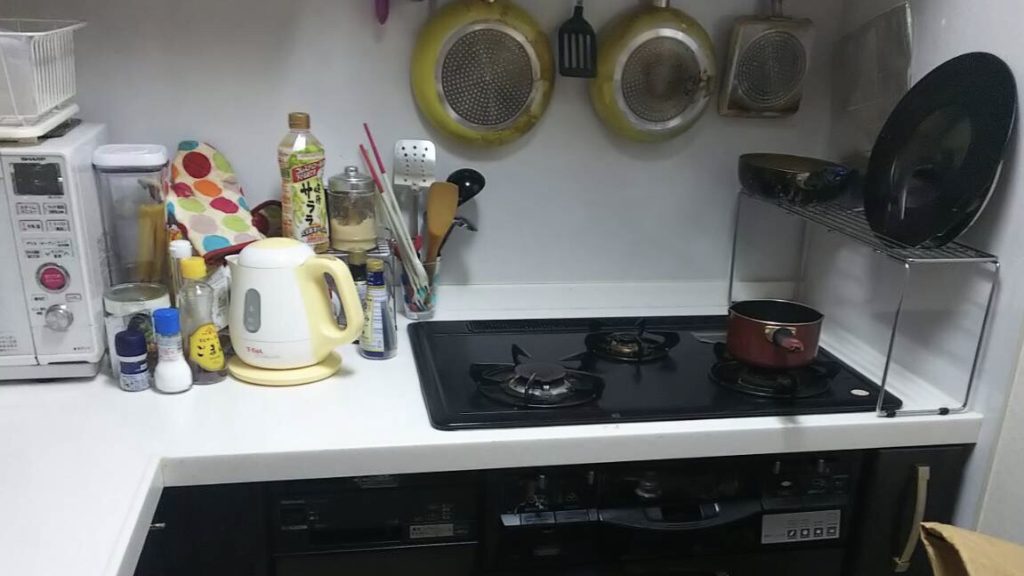
This screenshot has width=1024, height=576. I want to click on handle of tea kettle, so click(x=351, y=294).